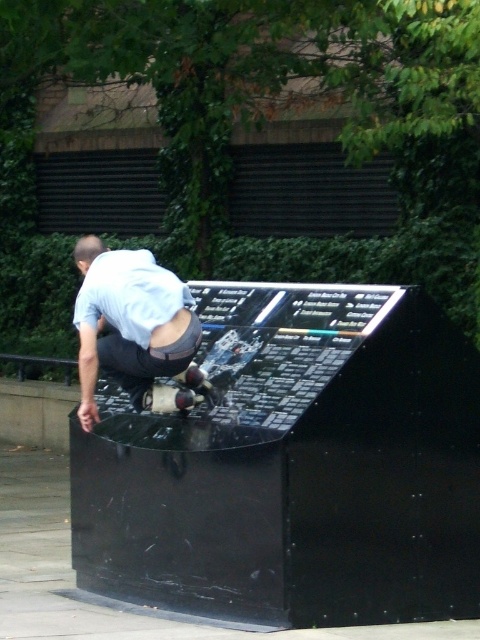
Question: Which object appears closest to the camera in this image?

Choices:
 (A) light blue shirt at center
 (B) shiny metallic skateboard at center

Answer: (A)

Question: Is light blue shirt at center closer to the viewer compared to shiny metallic skateboard at center?

Choices:
 (A) yes
 (B) no

Answer: (A)

Question: Is light blue shirt at center wider than shiny metallic skateboard at center?

Choices:
 (A) no
 (B) yes

Answer: (B)

Question: Among these objects, which one is nearest to the camera?

Choices:
 (A) shiny metallic skateboard at center
 (B) light blue shirt at center

Answer: (B)

Question: Does light blue shirt at center have a greater width compared to shiny metallic skateboard at center?

Choices:
 (A) no
 (B) yes

Answer: (B)